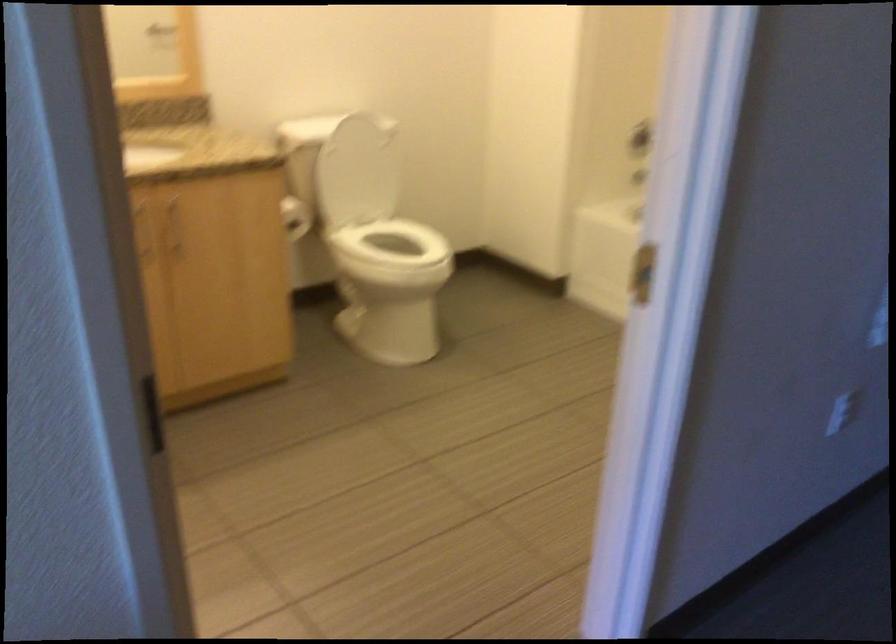
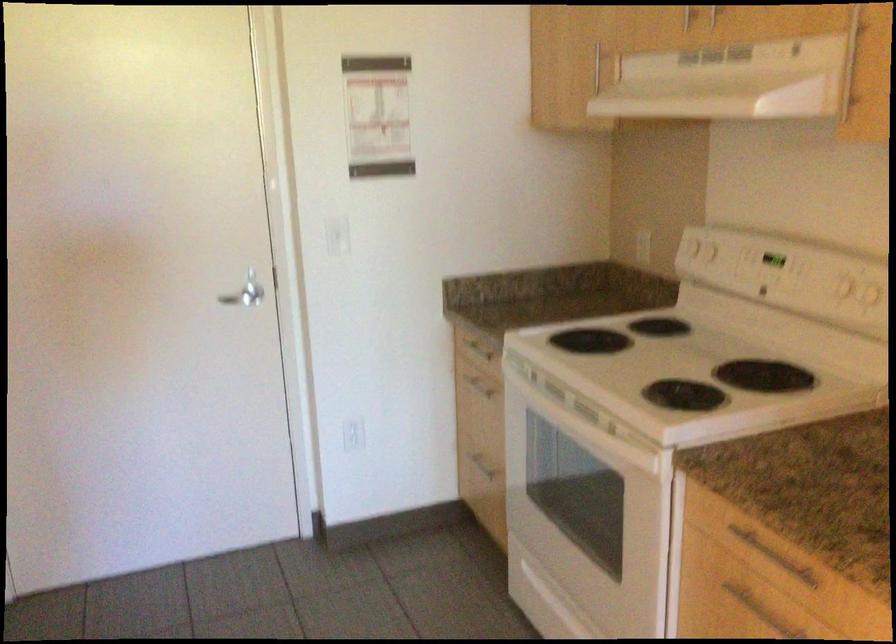
Question: Based on the continuous images, in which direction is the camera rotating? Reply with the corresponding letter.

Choices:
 (A) Left
 (B) Right
 (C) Up
 (D) Down

Answer: (B)